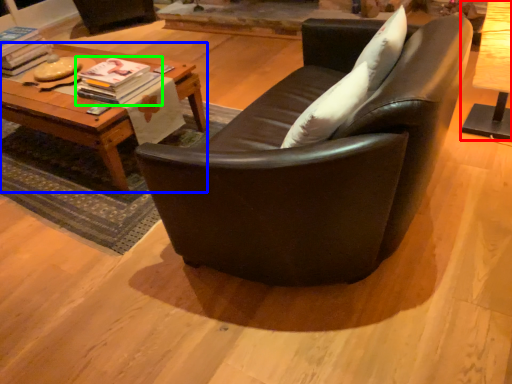
Question: Which is nearer to the table (highlighted by a red box)? table (highlighted by a blue box) or magazine (highlighted by a green box).

Choices:
 (A) table
 (B) magazine

Answer: (B)